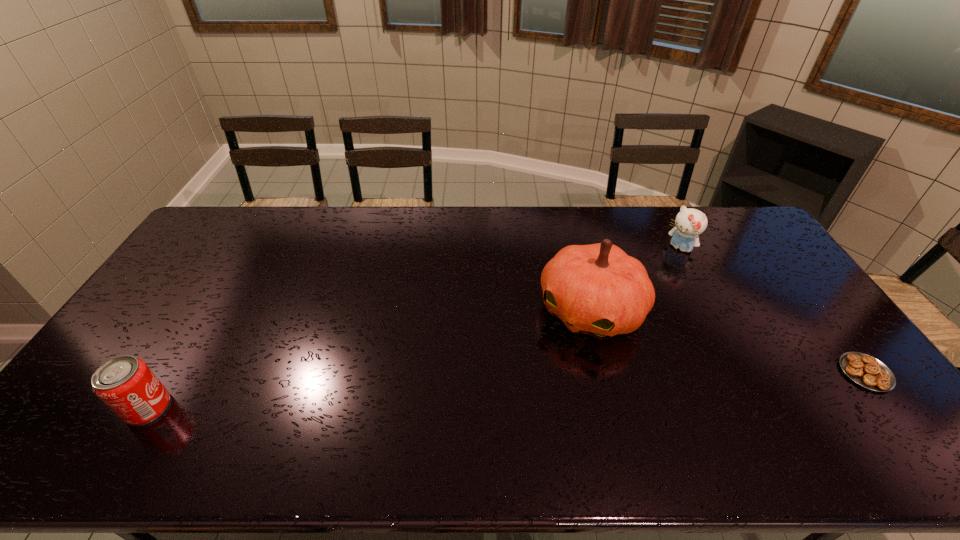
Identify the location of object located at the near left corner. (125, 384).

The image size is (960, 540). In order to click on object that is at the near right corner in this screenshot , I will do `click(867, 371)`.

What are the coordinates of `vacant space at the far edge` in the screenshot? It's located at (433, 217).

Find the location of a particular element. This screenshot has height=540, width=960. vacant area at the near edge is located at coordinates (747, 394).

Locate an element on the screen. The height and width of the screenshot is (540, 960). free spot at the left edge of the desktop is located at coordinates (212, 264).

The image size is (960, 540). What are the coordinates of `vacant space at the right edge of the desktop` in the screenshot? It's located at (765, 257).

In the image, there is a desktop. Identify the location of vacant space at the far left corner. (240, 232).

Where is `free spot between the farthest object and the rightmost object`? free spot between the farthest object and the rightmost object is located at coordinates click(773, 310).

The image size is (960, 540). Find the location of `vacant area between the kitten and the shortest object`. vacant area between the kitten and the shortest object is located at coordinates (773, 310).

Where is `free point between the can and the pastry`? free point between the can and the pastry is located at coordinates (507, 390).